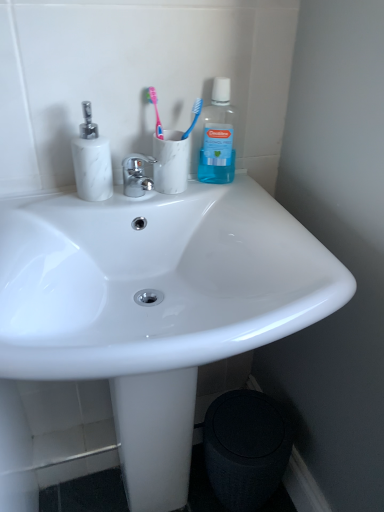
Where is `vacant space that is to the left of chrome/metallic faucet at center`? vacant space that is to the left of chrome/metallic faucet at center is located at coordinates (60, 205).